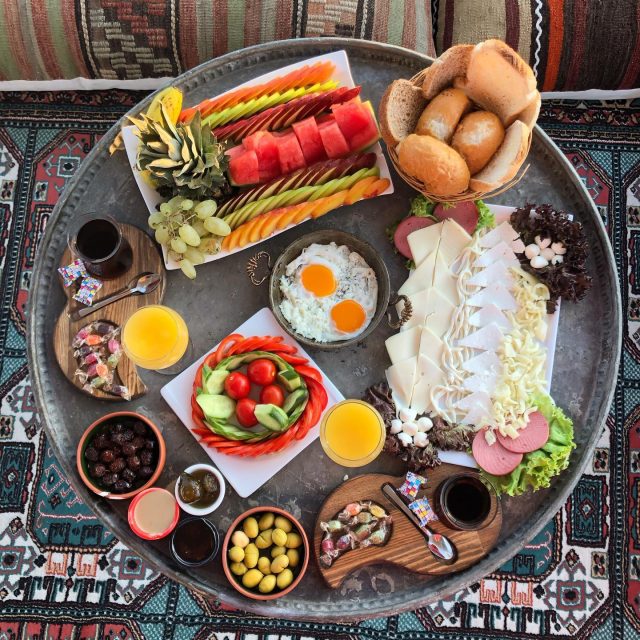
Image resolution: width=640 pixels, height=640 pixels. Find the location of `spoon`. spoon is located at coordinates (445, 548).